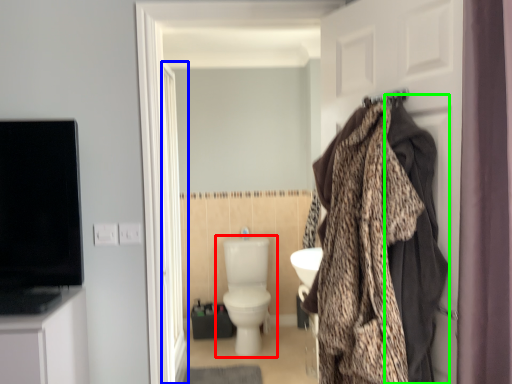
Question: Estimate the real-world distances between objects in this image. Which object is farther from toilet (highlighted by a red box), screen door (highlighted by a blue box) or blanket (highlighted by a green box)?

Choices:
 (A) screen door
 (B) blanket

Answer: (B)